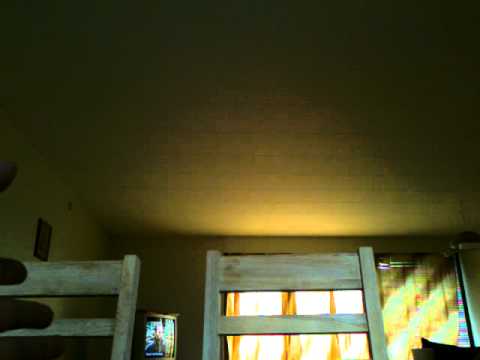
I want to click on curtain, so click(425, 320).